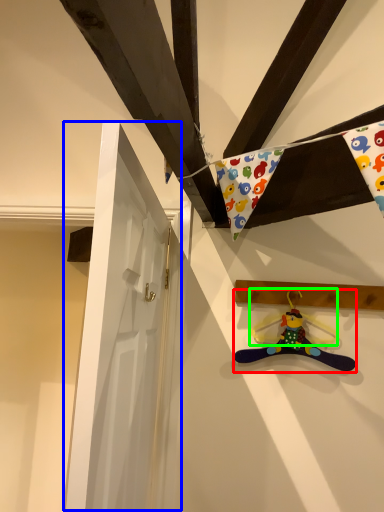
Question: Which is farther away from toy (highlighted by a red box)? door (highlighted by a blue box) or hanger (highlighted by a green box)?

Choices:
 (A) door
 (B) hanger

Answer: (A)